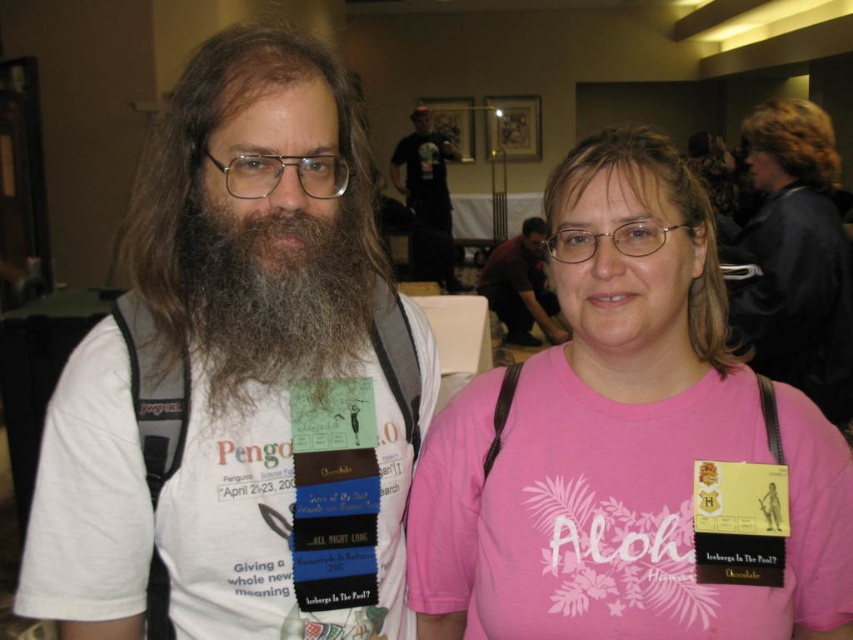
Does white t-shirt at center appear on the left side of light brown hair at center?

Yes, white t-shirt at center is to the left of light brown hair at center.

Who is positioned more to the right, white t-shirt at center or light brown hair at center?

light brown hair at center

Measure the distance between white t-shirt at center and camera.

They are 29.55 inches apart.

Where is `white t-shirt at center`? The height and width of the screenshot is (640, 853). white t-shirt at center is located at coordinates (239, 381).

Can you confirm if pink fabric shirt at center is taller than blonde hair at upper right?

Yes.

Does pink fabric shirt at center lie in front of blonde hair at upper right?

Yes, it is in front of blonde hair at upper right.

This screenshot has width=853, height=640. I want to click on pink fabric shirt at center, so click(621, 442).

Is brown fuzzy beard at left smaller than dark brown leather jacket at center?

Correct, brown fuzzy beard at left occupies less space than dark brown leather jacket at center.

What do you see at coordinates (270, 294) in the screenshot? I see `brown fuzzy beard at left` at bounding box center [270, 294].

Where is `brown fuzzy beard at left`? brown fuzzy beard at left is located at coordinates point(270,294).